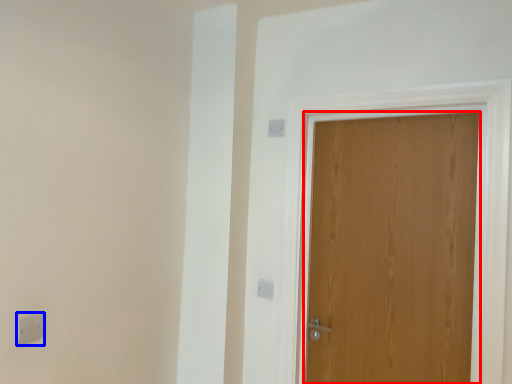
Question: Among these objects, which one is farthest to the camera, door (highlighted by a red box) or light switch (highlighted by a blue box)?

Choices:
 (A) door
 (B) light switch

Answer: (A)